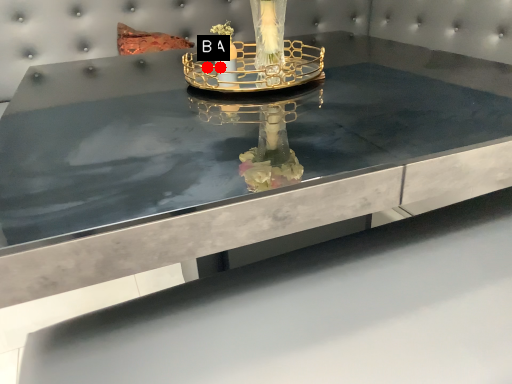
Question: Two points are circled on the image, labeled by A and B beside each circle. Which point is farther from the camera taking this photo?

Choices:
 (A) A is further
 (B) B is further

Answer: (B)